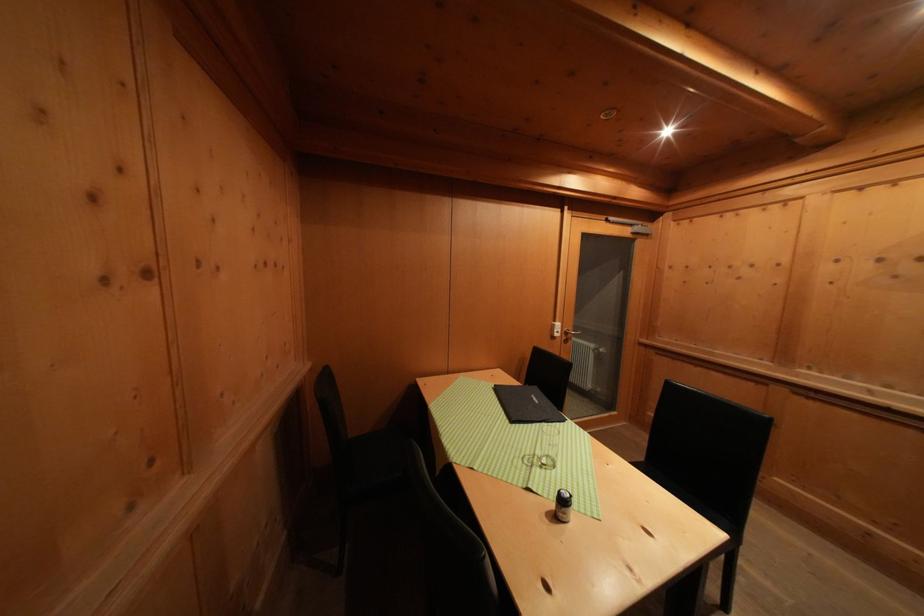
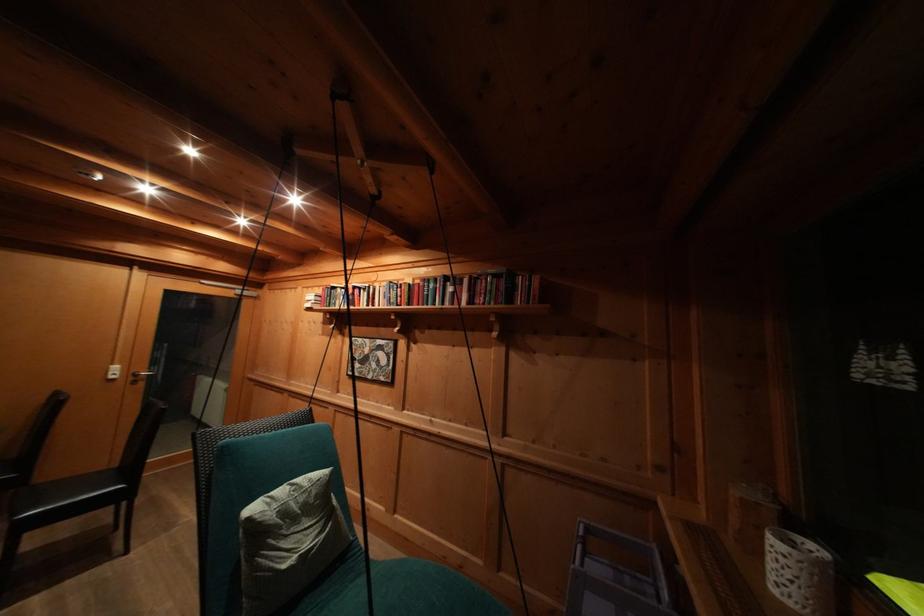
In the second image, find the point that corresponds to point (572, 339) in the first image.

(141, 379)